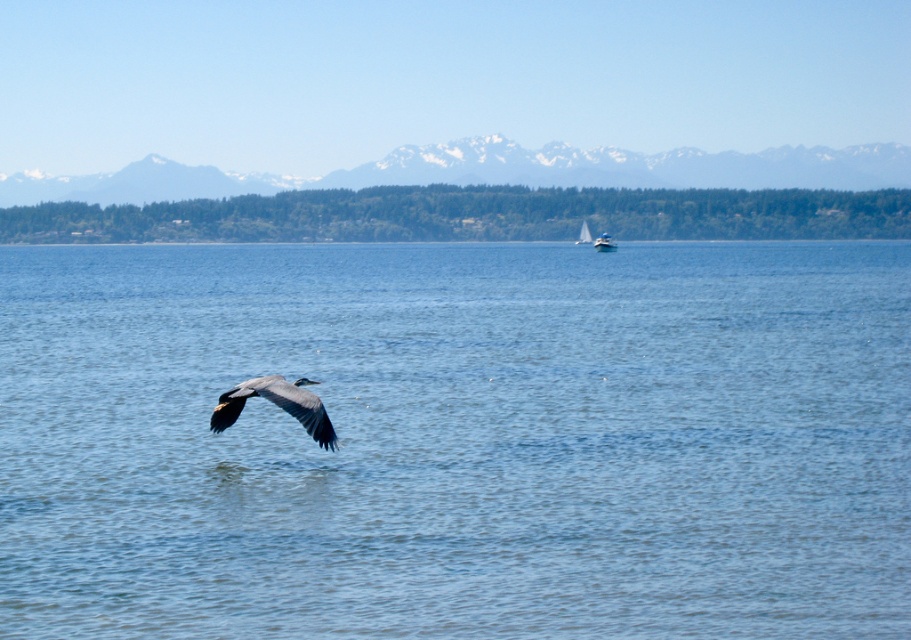
Does gray matte bird at center appear over white plastic boat at center?

No, gray matte bird at center is not above white plastic boat at center.

Locate an element on the screen. This screenshot has width=911, height=640. gray matte bird at center is located at coordinates (277, 404).

Where is `gray matte bird at center`? The image size is (911, 640). gray matte bird at center is located at coordinates (277, 404).

Does snowy white mountain at upper center appear on the left side of white plastic boat at center?

Yes, snowy white mountain at upper center is to the left of white plastic boat at center.

Between snowy white mountain at upper center and white plastic boat at center, which one appears on the left side from the viewer's perspective?

snowy white mountain at upper center is more to the left.

At what (x,y) coordinates should I click in order to perform the action: click on snowy white mountain at upper center. Please return your answer as a coordinate pair (x, y). This screenshot has height=640, width=911. Looking at the image, I should click on (493, 172).

Can you confirm if gray matte bird at center is positioned to the left of white sailboat at center?

Yes, gray matte bird at center is to the left of white sailboat at center.

Does gray matte bird at center have a larger size compared to white sailboat at center?

Actually, gray matte bird at center might be smaller than white sailboat at center.

Is point (280, 396) closer to camera compared to point (582, 227)?

Yes, point (280, 396) is closer to viewer.

The height and width of the screenshot is (640, 911). Find the location of `gray matte bird at center`. gray matte bird at center is located at coordinates (277, 404).